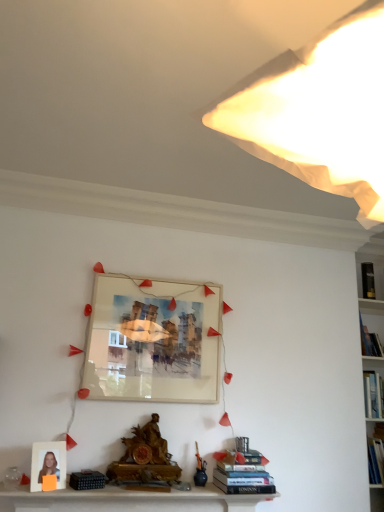
Question: In which direction should I rotate to look at hardcover books at lower center, positioned as the 1th book in front-to-back order?

Choices:
 (A) right
 (B) left

Answer: (A)

Question: Can you confirm if white paper lampshade at upper right is smaller than hardcover books at lower center, the third book in the right-to-left sequence?

Choices:
 (A) yes
 (B) no

Answer: (B)

Question: Considering the relative sizes of white paper lampshade at upper right and hardcover books at lower center, the 3th book when ordered from top to bottom, in the image provided, is white paper lampshade at upper right bigger than hardcover books at lower center, the 3th book when ordered from top to bottom,?

Choices:
 (A) yes
 (B) no

Answer: (A)

Question: Would you say white paper lampshade at upper right is outside hardcover books at lower center, the first book from the left?

Choices:
 (A) yes
 (B) no

Answer: (A)

Question: Considering the relative sizes of white paper lampshade at upper right and hardcover books at lower center, the third book in the right-to-left sequence, in the image provided, is white paper lampshade at upper right wider than hardcover books at lower center, the third book in the right-to-left sequence,?

Choices:
 (A) yes
 (B) no

Answer: (A)

Question: Can you confirm if white paper lampshade at upper right is positioned to the left of hardcover books at lower center, which is counted as the 3th book, starting from the back?

Choices:
 (A) no
 (B) yes

Answer: (B)

Question: Could you tell me if white paper lampshade at upper right is facing hardcover books at lower center, the first book from the left?

Choices:
 (A) yes
 (B) no

Answer: (B)

Question: Is white matte photo frame at lower left, which ranks as the first picture frame in left-to-right order, positioned in front of black hardcover book at upper right, positioned as the first book in back-to-front order?

Choices:
 (A) no
 (B) yes

Answer: (B)

Question: From the image's perspective, is white matte photo frame at lower left, marked as the first picture frame in a bottom-to-top arrangement, located beneath black hardcover book at upper right, marked as the first book in a right-to-left arrangement?

Choices:
 (A) yes
 (B) no

Answer: (A)

Question: From a real-world perspective, is white matte photo frame at lower left, which ranks as the first picture frame in left-to-right order, positioned over black hardcover book at upper right, the third book in the left-to-right sequence, based on gravity?

Choices:
 (A) no
 (B) yes

Answer: (A)

Question: From a real-world perspective, is white matte photo frame at lower left, which ranks as the first picture frame in left-to-right order, positioned under black hardcover book at upper right, the third book in the left-to-right sequence, based on gravity?

Choices:
 (A) yes
 (B) no

Answer: (A)

Question: Does white matte photo frame at lower left, marked as the 2th picture frame in a back-to-front arrangement, have a greater width compared to black hardcover book at upper right, positioned as the first book in back-to-front order?

Choices:
 (A) no
 (B) yes

Answer: (A)

Question: Is white matte photo frame at lower left, which ranks as the first picture frame in left-to-right order, bigger than black hardcover book at upper right, the third book in the left-to-right sequence?

Choices:
 (A) yes
 (B) no

Answer: (A)

Question: Does hardcover books at lower center, the third book in the right-to-left sequence, have a smaller size compared to black hardcover book at upper right, the third book viewed from the front?

Choices:
 (A) yes
 (B) no

Answer: (B)